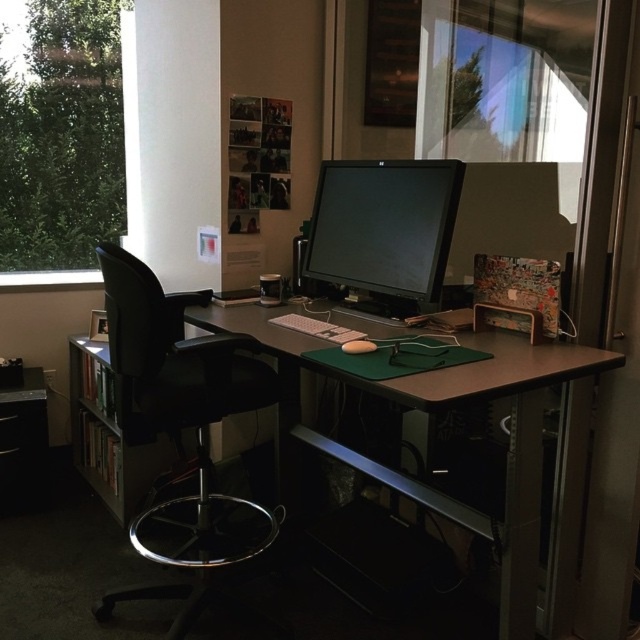
Question: Which point appears closest to the camera in this image?

Choices:
 (A) (497, 371)
 (B) (337, 188)
 (C) (586, 600)
 (D) (65, 131)

Answer: (A)

Question: Which object is positioned farthest from the transparent glass window at upper left?

Choices:
 (A) brown wood computer desk at center
 (B) matte black monitor at center
 (C) transparent glass door at upper center

Answer: (C)

Question: Can you confirm if transparent glass door at upper center is positioned to the right of brown wood computer desk at center?

Choices:
 (A) yes
 (B) no

Answer: (A)

Question: Which object is positioned farthest from the transparent glass window at upper left?

Choices:
 (A) black leather swivel chair at left
 (B) brown wood computer desk at center
 (C) transparent glass door at upper center

Answer: (C)

Question: Can you confirm if black leather swivel chair at left is bigger than matte black monitor at center?

Choices:
 (A) no
 (B) yes

Answer: (B)

Question: Is black leather swivel chair at left above brown wood computer desk at center?

Choices:
 (A) yes
 (B) no

Answer: (B)